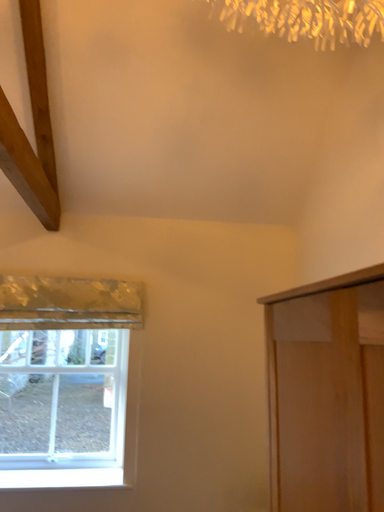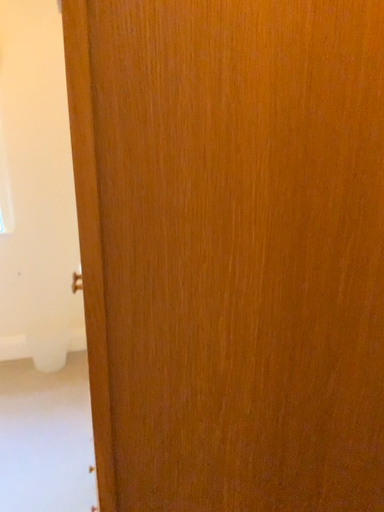
Question: How did the camera likely rotate when shooting the video?

Choices:
 (A) rotated right
 (B) rotated left

Answer: (A)